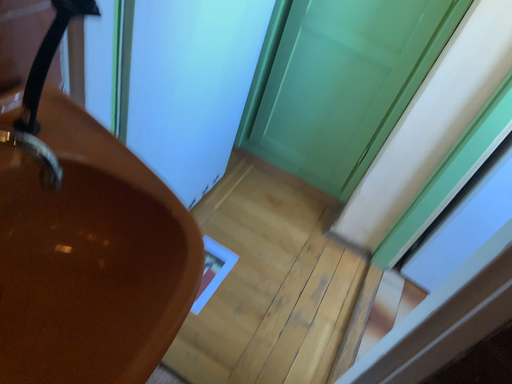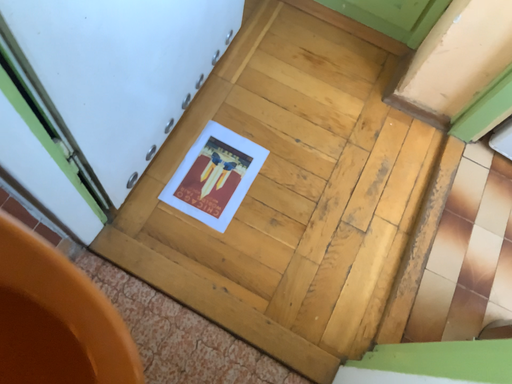
Question: How did the camera likely rotate when shooting the video?

Choices:
 (A) rotated downward
 (B) rotated upward

Answer: (A)